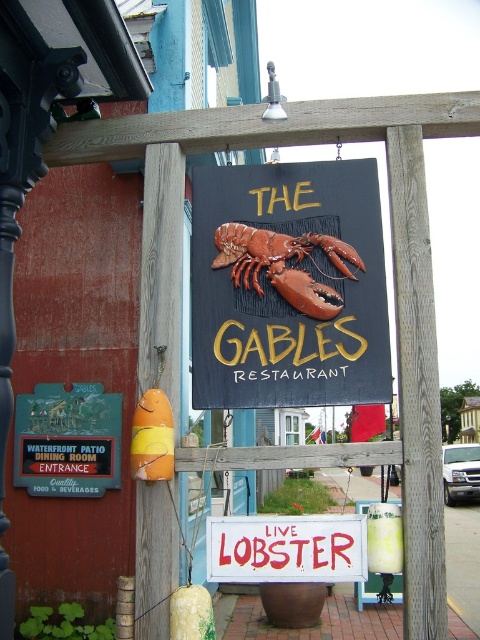
Can you confirm if red painted wood sign at center is positioned to the right of shiny red lobster at center?

Indeed, red painted wood sign at center is positioned on the right side of shiny red lobster at center.

Does point (303, 522) come in front of point (269, 259)?

Yes.

Between point (330, 579) and point (268, 280), which one is positioned in front?

Point (330, 579)

Image resolution: width=480 pixels, height=640 pixels. Identify the location of red painted wood sign at center. (x=287, y=548).

Does black plastic sign at lower left appear on the left side of red painted wood sign at center?

Indeed, black plastic sign at lower left is positioned on the left side of red painted wood sign at center.

Which of these two, black plastic sign at lower left or red painted wood sign at center, stands shorter?

red painted wood sign at center is shorter.

Locate an element on the screen. The width and height of the screenshot is (480, 640). black plastic sign at lower left is located at coordinates (68, 440).

Describe the element at coordinates (288, 285) in the screenshot. I see `matte wooden signboard with lobster at center` at that location.

Between matte wooden signboard with lobster at center and shiny red lobster at center, which one has more height?

Standing taller between the two is matte wooden signboard with lobster at center.

Who is more forward, (297, 385) or (226, 225)?

Point (297, 385)

Identify the location of matte wooden signboard with lobster at center. This screenshot has width=480, height=640. (288, 285).